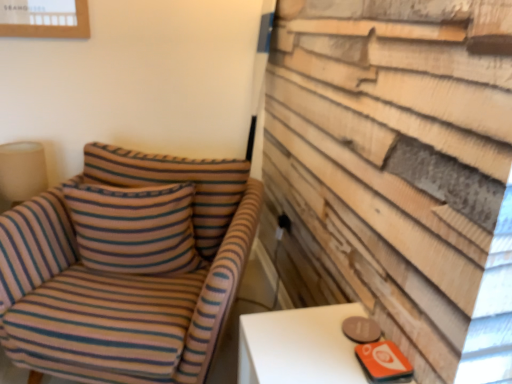
Question: Is the position of beige fabric lampshade at left more distant than that of striped fabric chair at left?

Choices:
 (A) no
 (B) yes

Answer: (B)

Question: From a real-world perspective, is beige fabric lampshade at left positioned under striped fabric chair at left based on gravity?

Choices:
 (A) no
 (B) yes

Answer: (A)

Question: Is beige fabric lampshade at left in contact with striped fabric chair at left?

Choices:
 (A) yes
 (B) no

Answer: (B)

Question: From the image's perspective, is beige fabric lampshade at left on top of striped fabric chair at left?

Choices:
 (A) yes
 (B) no

Answer: (A)

Question: Does beige fabric lampshade at left have a greater height compared to striped fabric chair at left?

Choices:
 (A) no
 (B) yes

Answer: (A)

Question: Does beige fabric lampshade at left have a lesser height compared to striped fabric chair at left?

Choices:
 (A) yes
 (B) no

Answer: (A)

Question: Is beige fabric lampshade at left oriented away from black plastic outlet at center-right?

Choices:
 (A) no
 (B) yes

Answer: (A)

Question: Does beige fabric lampshade at left have a greater height compared to black plastic outlet at center-right?

Choices:
 (A) no
 (B) yes

Answer: (B)

Question: Does beige fabric lampshade at left lie behind black plastic outlet at center-right?

Choices:
 (A) no
 (B) yes

Answer: (A)

Question: Is beige fabric lampshade at left to the right of black plastic outlet at center-right from the viewer's perspective?

Choices:
 (A) no
 (B) yes

Answer: (A)

Question: Is beige fabric lampshade at left bigger than black plastic outlet at center-right?

Choices:
 (A) yes
 (B) no

Answer: (A)

Question: Does beige fabric lampshade at left have a lesser width compared to black plastic outlet at center-right?

Choices:
 (A) yes
 (B) no

Answer: (B)

Question: From a real-world perspective, is black plastic outlet at center-right below beige fabric lampshade at left?

Choices:
 (A) no
 (B) yes

Answer: (B)